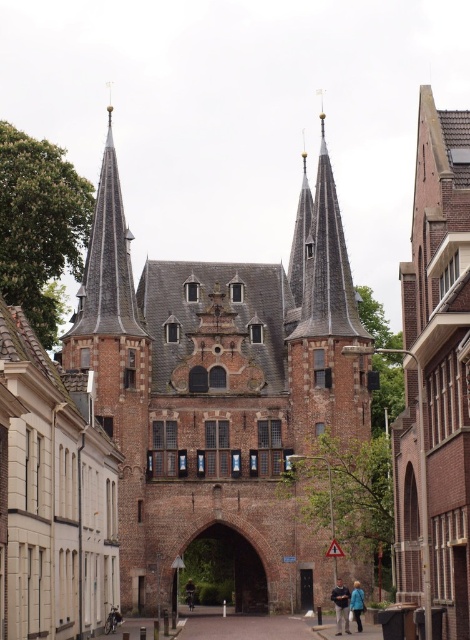
Who is higher up, brown stone archway at center or light brown leather jacket at center?

brown stone archway at center is higher up.

Does brown stone archway at center have a larger size compared to light brown leather jacket at center?

Correct, brown stone archway at center is larger in size than light brown leather jacket at center.

Is point (218, 586) positioned behind point (192, 588)?

Yes, it is.

The image size is (470, 640). What are the coordinates of `brown stone archway at center` in the screenshot? It's located at (226, 570).

From the picture: Between brown brick church at right and light brown leather jacket at center, which one is positioned lower?

light brown leather jacket at center

Can you confirm if brown brick church at right is smaller than light brown leather jacket at center?

Actually, brown brick church at right might be larger than light brown leather jacket at center.

Is point (469, 161) closer to camera compared to point (188, 602)?

Yes, it is in front of point (188, 602).

This screenshot has height=640, width=470. I want to click on brown brick church at right, so click(x=443, y=346).

Does point (170, 564) come farther from viewer compared to point (185, 593)?

No, (170, 564) is closer to viewer.

Image resolution: width=470 pixels, height=640 pixels. I want to click on brown brick church at center, so click(218, 396).

Image resolution: width=470 pixels, height=640 pixels. I want to click on brown brick church at center, so click(218, 396).